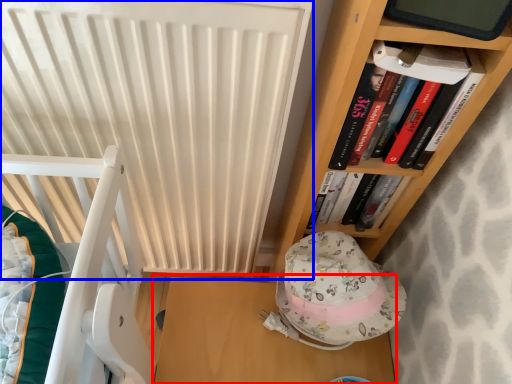
Question: Which point is closer to the camera, table (highlighted by a red box) or radiator (highlighted by a blue box)?

Choices:
 (A) table
 (B) radiator

Answer: (B)